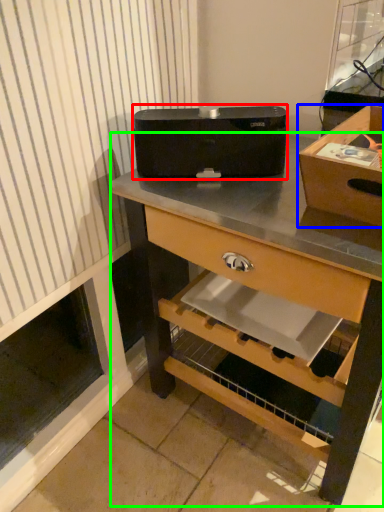
Question: Estimate the real-world distances between objects in this image. Which object is farther from appliance (highlighted by a red box), box (highlighted by a blue box) or desk (highlighted by a green box)?

Choices:
 (A) box
 (B) desk

Answer: (A)